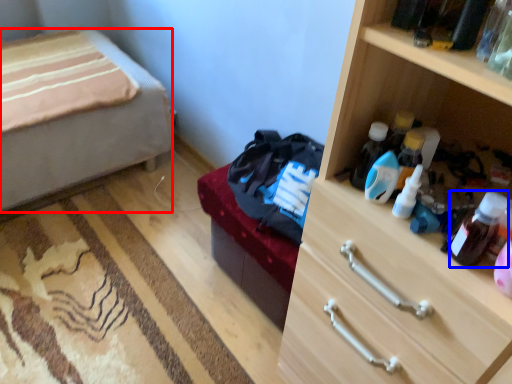
Question: Among these objects, which one is farthest to the camera, desk (highlighted by a red box) or bottle (highlighted by a blue box)?

Choices:
 (A) desk
 (B) bottle

Answer: (A)